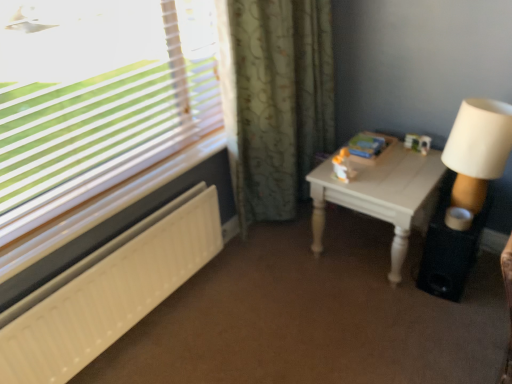
Find the location of a particular element. vacant area that lies between white textured radiator at lower left and white wood table at right is located at coordinates (258, 306).